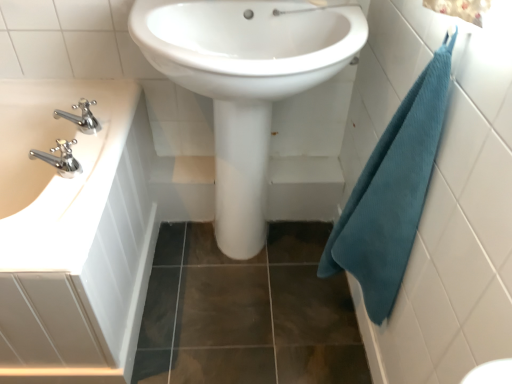
What is the approximate width of chrome metallic faucet at left?

The width of chrome metallic faucet at left is 5.17 inches.

Measure the distance between point (95, 123) and camera.

1.18 meters.

Locate an element on the screen. white glossy sink at center, positioned as the second sink in left-to-right order is located at coordinates (245, 84).

Where is `white glossy sink at left, which ranks as the 2th sink in right-to-left order`? The width and height of the screenshot is (512, 384). white glossy sink at left, which ranks as the 2th sink in right-to-left order is located at coordinates (55, 170).

Is white glossy sink at left, which ranks as the 2th sink in right-to-left order, shorter than chrome metallic faucet at left?

In fact, white glossy sink at left, which ranks as the 2th sink in right-to-left order, may be taller than chrome metallic faucet at left.

Which object is closer to the camera taking this photo, white glossy sink at left, which ranks as the 2th sink in right-to-left order, or chrome metallic faucet at left?

white glossy sink at left, which ranks as the 2th sink in right-to-left order, is more forward.

Is chrome metallic faucet at left at the back of white glossy sink at left, placed as the first sink when sorted from left to right?

That's not correct — white glossy sink at left, placed as the first sink when sorted from left to right, is not looking away from chrome metallic faucet at left.

Is the surface of white glossy sink at left, which ranks as the 2th sink in right-to-left order, in direct contact with chrome metallic faucet at left?

No, white glossy sink at left, which ranks as the 2th sink in right-to-left order, is not with chrome metallic faucet at left.

The width and height of the screenshot is (512, 384). Find the location of `bath towel above the white glossy sink at left, placed as the first sink when sorted from left to right (from a real-world perspective)`. bath towel above the white glossy sink at left, placed as the first sink when sorted from left to right (from a real-world perspective) is located at coordinates (392, 192).

Is teal waffle towel at right at the back of white glossy sink at left, which ranks as the 2th sink in right-to-left order?

No, white glossy sink at left, which ranks as the 2th sink in right-to-left order,'s orientation is not away from teal waffle towel at right.

Is white glossy sink at left, which ranks as the 2th sink in right-to-left order, to the left or to the right of teal waffle towel at right in the image?

From the image, it's evident that white glossy sink at left, which ranks as the 2th sink in right-to-left order, is to the left of teal waffle towel at right.

Is point (117, 133) in front of point (372, 168)?

No, it is not.

From a real-world perspective, does teal waffle towel at right sit lower than white glossy sink at left, placed as the first sink when sorted from left to right?

No, from a real-world perspective, teal waffle towel at right is not beneath white glossy sink at left, placed as the first sink when sorted from left to right.

Measure the distance between teal waffle towel at right and white glossy sink at left, placed as the first sink when sorted from left to right.

27.74 inches.

Can you tell me how much teal waffle towel at right and white glossy sink at left, placed as the first sink when sorted from left to right, differ in facing direction?

The angular difference between teal waffle towel at right and white glossy sink at left, placed as the first sink when sorted from left to right, is 89.7 degrees.

Is there a large distance between teal waffle towel at right and white glossy sink at left, placed as the first sink when sorted from left to right?

No, teal waffle towel at right is in close proximity to white glossy sink at left, placed as the first sink when sorted from left to right.

Locate an element on the screen. sink located on the right of chrome metallic faucet at left is located at coordinates (245, 84).

Which of these two, white glossy sink at center, positioned as the second sink in left-to-right order, or chrome metallic faucet at left, is smaller?

chrome metallic faucet at left.

Would you say white glossy sink at center, positioned as the second sink in left-to-right order, is to the left or to the right of chrome metallic faucet at left in the picture?

white glossy sink at center, positioned as the second sink in left-to-right order, is to the right of chrome metallic faucet at left.

Is chrome metallic faucet at left located within white glossy sink at center, marked as the first sink in a right-to-left arrangement?

No, chrome metallic faucet at left is located outside of white glossy sink at center, marked as the first sink in a right-to-left arrangement.

Considering the positions of objects chrome metallic faucet at left and white glossy sink at left, which ranks as the 2th sink in right-to-left order, in the image provided, who is behind, chrome metallic faucet at left or white glossy sink at left, which ranks as the 2th sink in right-to-left order,?

chrome metallic faucet at left is behind.

Looking at this image, could you tell me if chrome metallic faucet at left is facing white glossy sink at left, which ranks as the 2th sink in right-to-left order?

No, chrome metallic faucet at left is not aimed at white glossy sink at left, which ranks as the 2th sink in right-to-left order.

Are chrome metallic faucet at left and white glossy sink at left, which ranks as the 2th sink in right-to-left order, located far from each other?

No, there isn't a large distance between chrome metallic faucet at left and white glossy sink at left, which ranks as the 2th sink in right-to-left order.

Does chrome metallic faucet at left contain white glossy sink at left, which ranks as the 2th sink in right-to-left order?

No, chrome metallic faucet at left does not contain white glossy sink at left, which ranks as the 2th sink in right-to-left order.

Can you confirm if teal waffle towel at right is positioned to the right of white glossy sink at center, marked as the first sink in a right-to-left arrangement?

Yes, teal waffle towel at right is to the right of white glossy sink at center, marked as the first sink in a right-to-left arrangement.

Could you tell me if teal waffle towel at right is turned towards white glossy sink at center, positioned as the second sink in left-to-right order?

No.

Is teal waffle towel at right bigger than white glossy sink at center, positioned as the second sink in left-to-right order?

No, teal waffle towel at right is not bigger than white glossy sink at center, positioned as the second sink in left-to-right order.

From a real-world perspective, which is physically below, teal waffle towel at right or white glossy sink at center, positioned as the second sink in left-to-right order?

white glossy sink at center, positioned as the second sink in left-to-right order, from a real-world perspective.

Does chrome metallic faucet at left appear on the right side of teal waffle towel at right?

In fact, chrome metallic faucet at left is to the left of teal waffle towel at right.

The width and height of the screenshot is (512, 384). In order to click on tap above the teal waffle towel at right (from the image's perspective) in this screenshot , I will do `click(81, 117)`.

Considering the relative sizes of chrome metallic faucet at left and teal waffle towel at right in the image provided, is chrome metallic faucet at left shorter than teal waffle towel at right?

Yes, chrome metallic faucet at left is shorter than teal waffle towel at right.

Locate an element on the screen. This screenshot has height=384, width=512. tap behind the white glossy sink at left, placed as the first sink when sorted from left to right is located at coordinates (81, 117).

Identify the location of bath towel in front of the white glossy sink at left, which ranks as the 2th sink in right-to-left order. This screenshot has width=512, height=384. (392, 192).

Which object lies further to the anchor point chrome metallic faucet at left, white glossy sink at left, placed as the first sink when sorted from left to right, or teal waffle towel at right?

The object further to chrome metallic faucet at left is teal waffle towel at right.

Looking at the image, which one is located closer to white glossy sink at center, marked as the first sink in a right-to-left arrangement, teal waffle towel at right or chrome metallic faucet at left?

teal waffle towel at right lies closer to white glossy sink at center, marked as the first sink in a right-to-left arrangement, than the other object.

Based on their spatial positions, is white glossy sink at left, placed as the first sink when sorted from left to right, or chrome metallic faucet at left closer to white glossy sink at center, marked as the first sink in a right-to-left arrangement?

Among the two, white glossy sink at left, placed as the first sink when sorted from left to right, is located nearer to white glossy sink at center, marked as the first sink in a right-to-left arrangement.

When comparing their distances from white glossy sink at left, placed as the first sink when sorted from left to right, does teal waffle towel at right or chrome metallic faucet at left seem closer?

chrome metallic faucet at left is closer to white glossy sink at left, placed as the first sink when sorted from left to right.

Estimate the real-world distances between objects in this image. Which object is closer to teal waffle towel at right, white glossy sink at center, marked as the first sink in a right-to-left arrangement, or chrome metallic faucet at left?

white glossy sink at center, marked as the first sink in a right-to-left arrangement, lies closer to teal waffle towel at right than the other object.

Looking at the image, which one is located closer to white glossy sink at center, marked as the first sink in a right-to-left arrangement, teal waffle towel at right or white glossy sink at left, placed as the first sink when sorted from left to right?

teal waffle towel at right is positioned closer to the anchor white glossy sink at center, marked as the first sink in a right-to-left arrangement.

Based on their spatial positions, is white glossy sink at left, which ranks as the 2th sink in right-to-left order, or white glossy sink at center, positioned as the second sink in left-to-right order, closer to chrome metallic faucet at left?

Among the two, white glossy sink at left, which ranks as the 2th sink in right-to-left order, is located nearer to chrome metallic faucet at left.

From the image, which object appears to be farther from white glossy sink at left, placed as the first sink when sorted from left to right, chrome metallic faucet at left or white glossy sink at center, marked as the first sink in a right-to-left arrangement?

The object further to white glossy sink at left, placed as the first sink when sorted from left to right, is white glossy sink at center, marked as the first sink in a right-to-left arrangement.

At what (x,y) coordinates should I click in order to perform the action: click on tap situated between white glossy sink at left, which ranks as the 2th sink in right-to-left order, and white glossy sink at center, positioned as the second sink in left-to-right order, from left to right. Please return your answer as a coordinate pair (x, y). This screenshot has height=384, width=512. Looking at the image, I should click on (81, 117).

What are the coordinates of `sink between chrome metallic faucet at left and teal waffle towel at right in the horizontal direction` in the screenshot? It's located at (245, 84).

Where is `sink between white glossy sink at left, placed as the first sink when sorted from left to right, and teal waffle towel at right`? sink between white glossy sink at left, placed as the first sink when sorted from left to right, and teal waffle towel at right is located at coordinates (245, 84).

This screenshot has height=384, width=512. I want to click on tap between white glossy sink at left, which ranks as the 2th sink in right-to-left order, and teal waffle towel at right, so click(x=81, y=117).